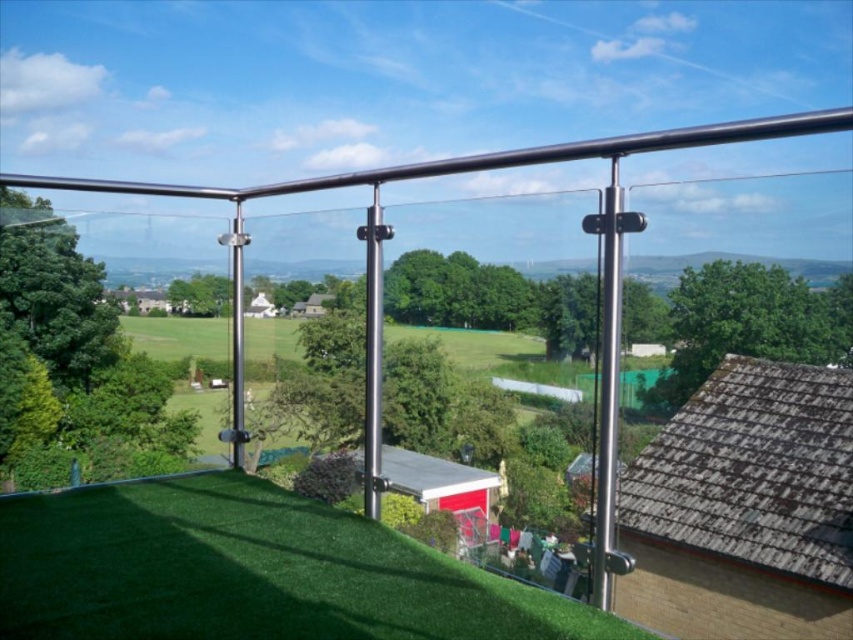
Consider the image. Can you confirm if green artificial turf at lower center is shorter than polished metal pole at center?

Yes, green artificial turf at lower center is shorter than polished metal pole at center.

Can you confirm if green artificial turf at lower center is wider than polished metal pole at center?

Yes.

Between point (252, 614) and point (372, 438), which one is positioned behind?

Positioned behind is point (372, 438).

Identify the location of green artificial turf at lower center. (250, 572).

Does polished metal pole at center have a smaller size compared to satin silver pole at center?

Yes.

The width and height of the screenshot is (853, 640). I want to click on polished metal pole at center, so click(x=373, y=353).

The image size is (853, 640). In order to click on polished metal pole at center in this screenshot , I will do `click(373, 353)`.

At what (x,y) coordinates should I click in order to perform the action: click on polished metal pole at center. Please return your answer as a coordinate pair (x, y). The image size is (853, 640). Looking at the image, I should click on (373, 353).

Is green artificial turf at lower center further to camera compared to satin silver pole at center?

No, it is not.

Is point (158, 540) farther from viewer compared to point (231, 381)?

No, (158, 540) is closer to viewer.

Locate an element on the screen. The image size is (853, 640). green artificial turf at lower center is located at coordinates click(250, 572).